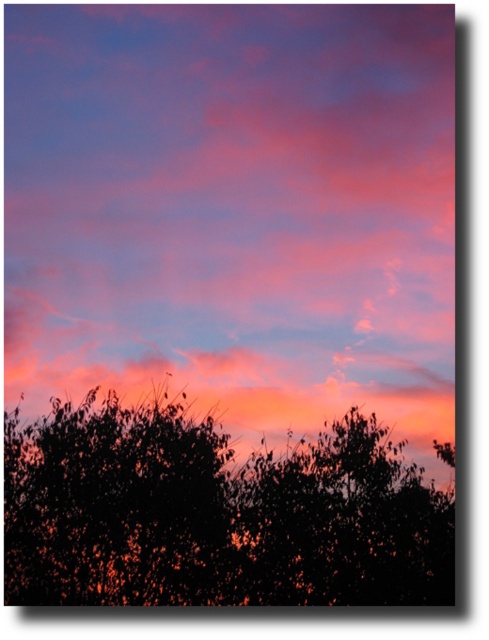
Question: Does pink cotton candy cloud at upper center appear on the right side of black leafy tree at bottom?

Choices:
 (A) yes
 (B) no

Answer: (A)

Question: Is pink cotton candy cloud at upper center wider than black leafy tree at bottom?

Choices:
 (A) no
 (B) yes

Answer: (B)

Question: Which of the following is the closest to the observer?

Choices:
 (A) pink cotton candy cloud at upper center
 (B) black leafy tree at bottom

Answer: (B)

Question: Which point appears farthest from the camera in this image?

Choices:
 (A) (4, 548)
 (B) (377, 340)

Answer: (B)

Question: Can you confirm if pink cotton candy cloud at upper center is thinner than black leafy tree at bottom?

Choices:
 (A) yes
 (B) no

Answer: (B)